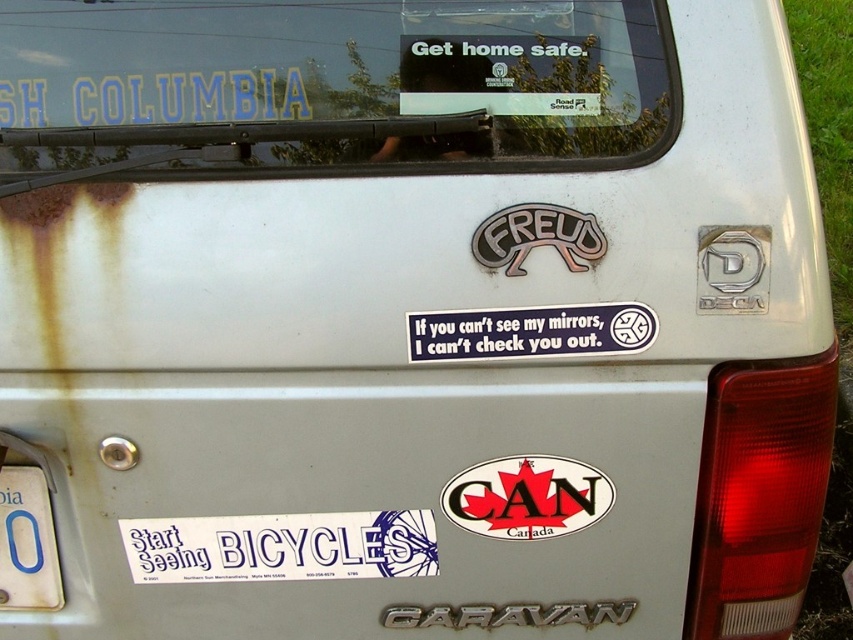
Question: Which point is farther from the camera taking this photo?

Choices:
 (A) (202, 520)
 (B) (144, 72)
 (C) (534, 499)
 (D) (55, 598)

Answer: (D)

Question: Can you confirm if white paper sticker at lower center is thinner than white plastic license plate at lower left?

Choices:
 (A) no
 (B) yes

Answer: (A)

Question: Which object is positioned closest to the white plastic license plate at lower left?

Choices:
 (A) oval matte canada sticker at lower center
 (B) blue matte sticker at center
 (C) transparent glass windshield at upper center
 (D) white paper sticker at lower center

Answer: (D)

Question: Can you confirm if white paper sticker at lower center is positioned above oval matte canada sticker at lower center?

Choices:
 (A) yes
 (B) no

Answer: (B)

Question: Can you confirm if transparent glass windshield at upper center is positioned below white paper sticker at lower center?

Choices:
 (A) yes
 (B) no

Answer: (B)

Question: Which object appears farthest from the camera in this image?

Choices:
 (A) blue matte sticker at center
 (B) oval matte canada sticker at lower center
 (C) white paper sticker at lower center
 (D) transparent glass windshield at upper center

Answer: (C)